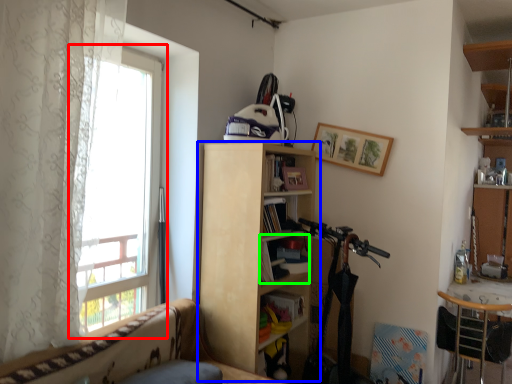
Question: Which is nearer to the window (highlighted by a red box)? bookcase (highlighted by a blue box) or book (highlighted by a green box).

Choices:
 (A) bookcase
 (B) book

Answer: (A)